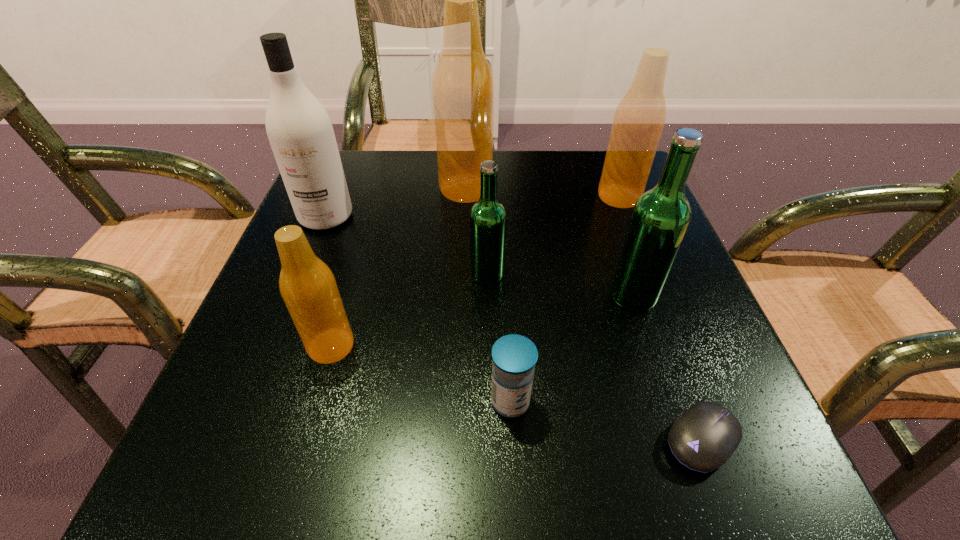
Where is `computer mouse`? computer mouse is located at coordinates (703, 438).

Where is `the shortest object`? This screenshot has width=960, height=540. the shortest object is located at coordinates (703, 438).

Where is `free space located on the front of the tallest beer bottle`? The height and width of the screenshot is (540, 960). free space located on the front of the tallest beer bottle is located at coordinates (465, 225).

Locate an element on the screen. vacant area located 0.200m on the front-facing side of the shampoo is located at coordinates (288, 310).

Where is `vacant space located 0.380m on the left of the rightmost tan beer bottle`? This screenshot has width=960, height=540. vacant space located 0.380m on the left of the rightmost tan beer bottle is located at coordinates (424, 197).

At what (x,y) coordinates should I click in order to perform the action: click on vacant space located on the back of the bigger green beer bottle. Please return your answer as a coordinate pair (x, y). This screenshot has width=960, height=540. Looking at the image, I should click on (594, 178).

At what (x,y) coordinates should I click in order to perform the action: click on vacant space located 0.280m on the back of the left green beer bottle. Please return your answer as a coordinate pair (x, y). This screenshot has height=540, width=960. Looking at the image, I should click on (486, 179).

Find the location of a particular element. This screenshot has width=960, height=540. free space located on the left of the leftmost beer bottle is located at coordinates (237, 346).

Identify the location of vacant position located on the left of the blue medicine. (425, 401).

The image size is (960, 540). In order to click on vacant space located on the back of the black computer mouse in this screenshot , I will do `click(666, 341)`.